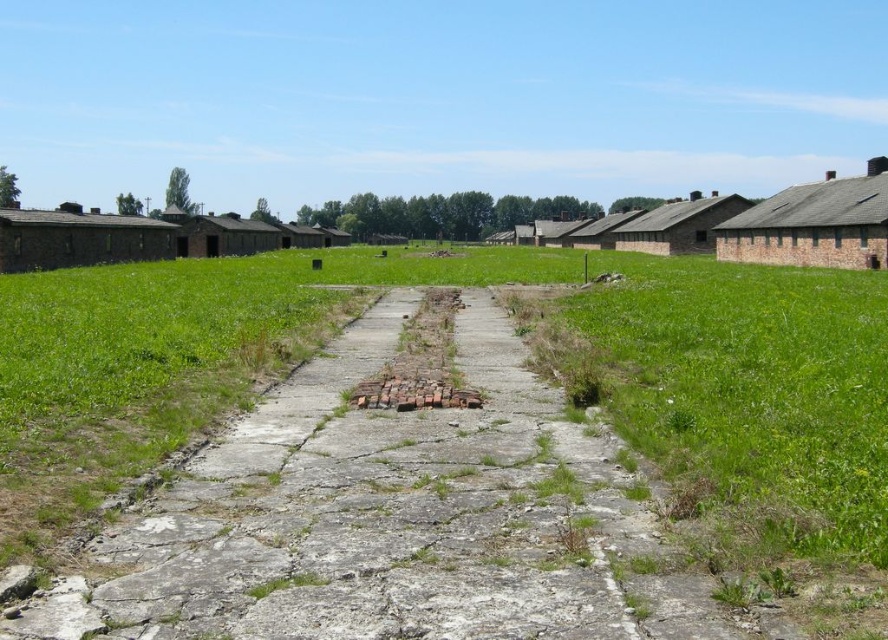
Which is in front, point (10, 257) or point (702, 227)?

Positioned in front is point (10, 257).

Describe the element at coordinates (78, 237) in the screenshot. I see `brown brick hut at left` at that location.

The image size is (888, 640). I want to click on brown brick hut at left, so click(78, 237).

Who is lower down, brown brick hut at upper right or brown brick hut at right?

brown brick hut at upper right is below.

Can you confirm if brown brick hut at upper right is shorter than brown brick hut at right?

Correct, brown brick hut at upper right is not as tall as brown brick hut at right.

The width and height of the screenshot is (888, 640). What do you see at coordinates (814, 225) in the screenshot? I see `brown brick hut at upper right` at bounding box center [814, 225].

Where is `brown brick hut at upper right`? The height and width of the screenshot is (640, 888). brown brick hut at upper right is located at coordinates (814, 225).

Can you confirm if brown brick hut at upper right is shorter than brown brick hut at center?

Yes.

Does point (823, 198) lie in front of point (255, 220)?

That is True.

What are the coordinates of `brown brick hut at upper right` in the screenshot? It's located at (814, 225).